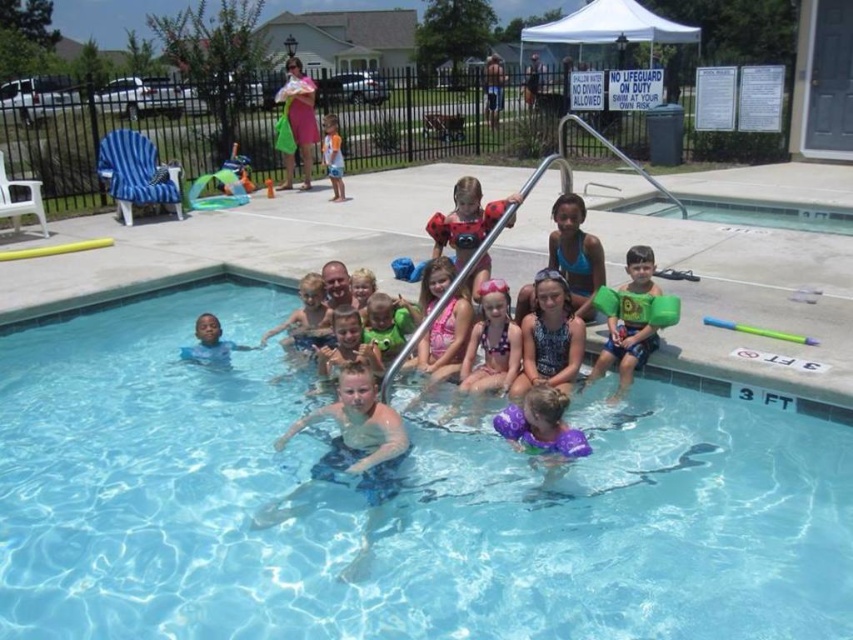
Is blue swim trunks at center to the right of green foam arm bands at center from the viewer's perspective?

No, blue swim trunks at center is not to the right of green foam arm bands at center.

Where is `blue swim trunks at center`? The height and width of the screenshot is (640, 853). blue swim trunks at center is located at coordinates (351, 452).

Identify the location of ladybug costume at center. The height and width of the screenshot is (640, 853). (465, 220).

Who is more forward, (502, 208) or (380, 346)?

Point (380, 346) is more forward.

Who is more forward, (432, 220) or (387, 348)?

Point (387, 348)

In order to click on ladybug costume at center in this screenshot , I will do `click(465, 220)`.

Does ladybug costume at center appear on the left side of light brown hair at center?

In fact, ladybug costume at center is to the right of light brown hair at center.

Does ladybug costume at center have a lesser width compared to light brown hair at center?

In fact, ladybug costume at center might be wider than light brown hair at center.

Between point (433, 244) and point (372, 356), which one is positioned behind?

Positioned behind is point (433, 244).

The width and height of the screenshot is (853, 640). I want to click on ladybug costume at center, so click(465, 220).